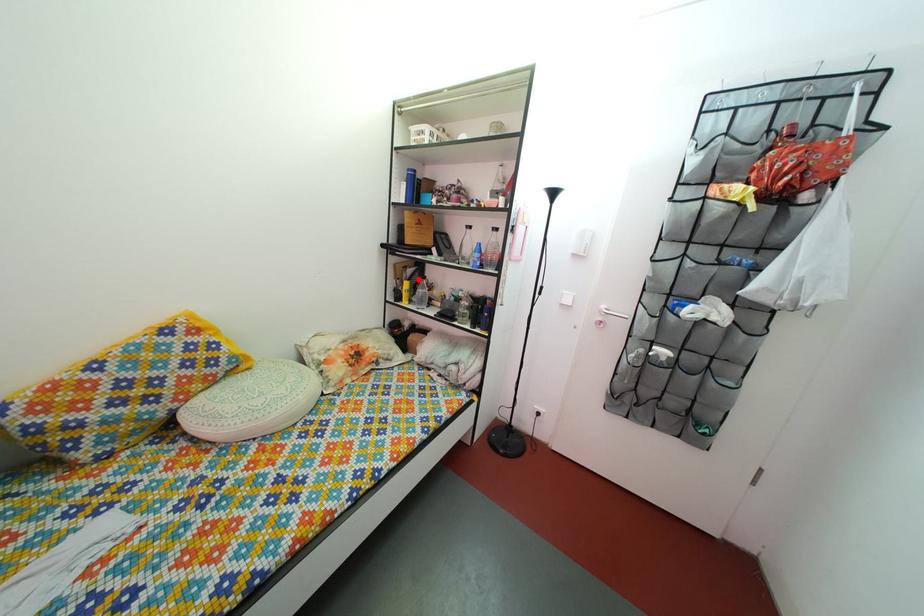
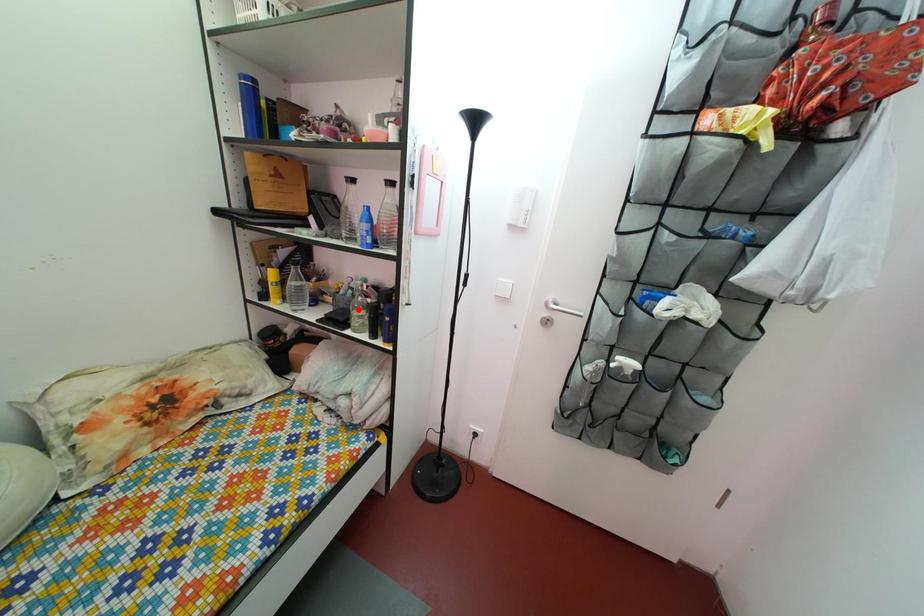
I am providing you with two images of the same scene from different viewpoints. A red point is marked on the first image and another point is marked on the second image. Are the points marked in image1 and image2 representing the same 3D position?

No